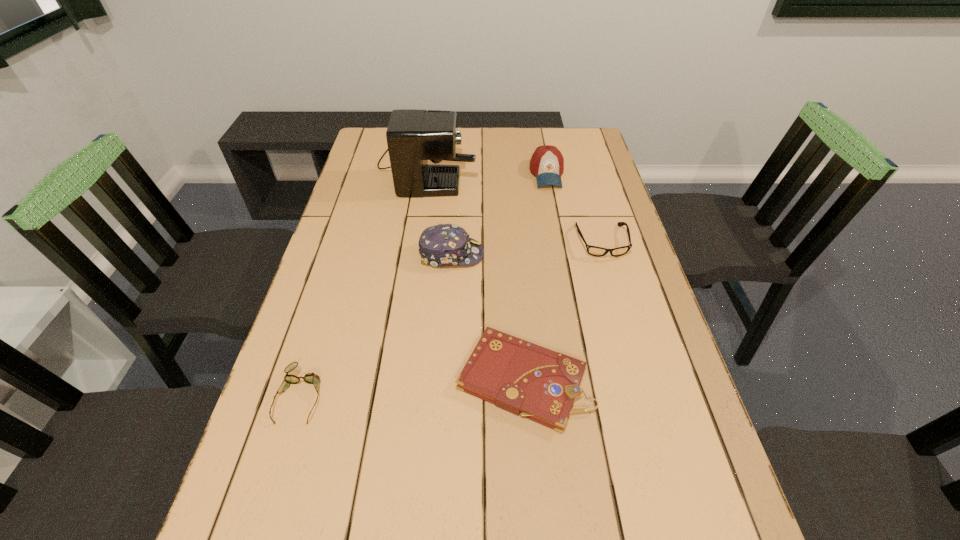
Locate an element on the screen. This screenshot has width=960, height=540. object that is at the far left corner is located at coordinates (413, 136).

Where is `object that is at the far right corner`? This screenshot has width=960, height=540. object that is at the far right corner is located at coordinates (547, 163).

In the image, there is a desktop. Where is `free space at the far edge`? Image resolution: width=960 pixels, height=540 pixels. free space at the far edge is located at coordinates (531, 146).

This screenshot has width=960, height=540. Identify the location of vacant space at the left edge of the desktop. (274, 507).

In order to click on vacant region at the right edge in this screenshot , I will do `click(563, 180)`.

In the image, there is a desktop. Find the location of `vacant region at the far right corner`. vacant region at the far right corner is located at coordinates (567, 130).

Find the location of a particular element. This screenshot has width=960, height=540. empty space that is in between the notebook and the shorter spectacles is located at coordinates (412, 387).

You are a GUI agent. You are given a task and a screenshot of the screen. Output one action in this format:
    pyautogui.click(x=<x>, y=<y>)
    Task: Click on the free space between the baseball cap and the tallest object
    The height and width of the screenshot is (540, 960).
    Given the screenshot: What is the action you would take?
    pyautogui.click(x=487, y=169)

The image size is (960, 540). Identify the location of free point between the headwear and the tallest object. (440, 209).

The image size is (960, 540). I want to click on free space between the notebook and the left spectacles, so click(x=412, y=387).